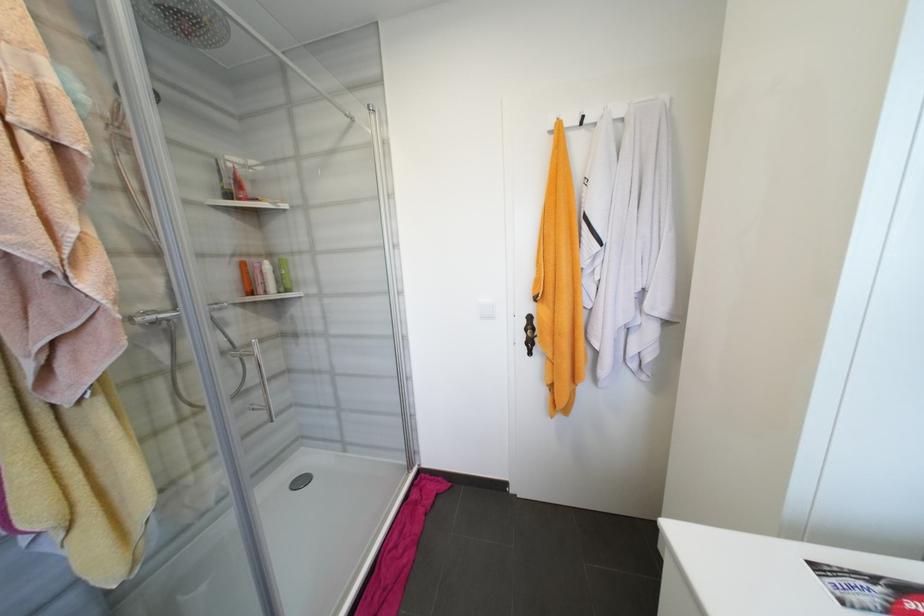
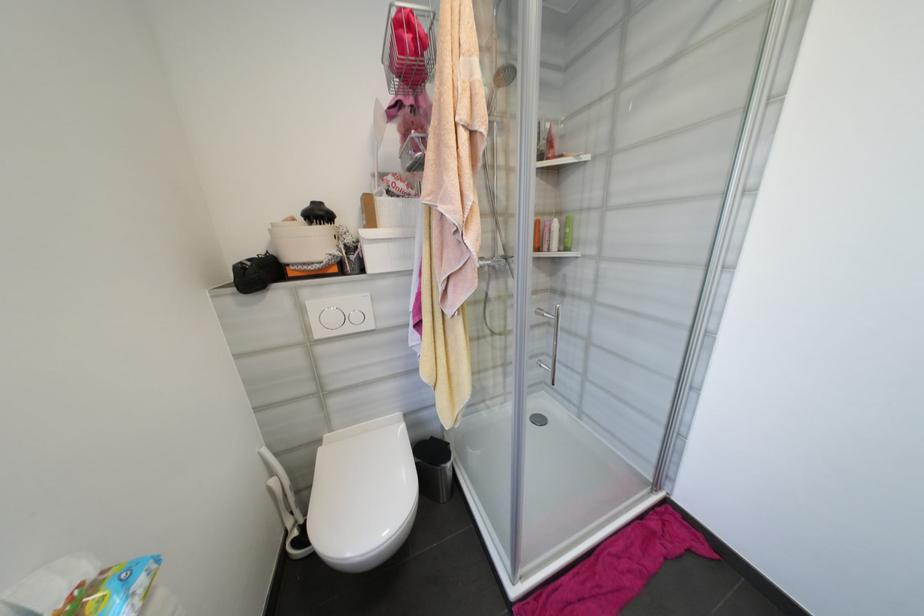
In the second image, find the point that corresponds to point 266,292 in the first image.

(551, 249)